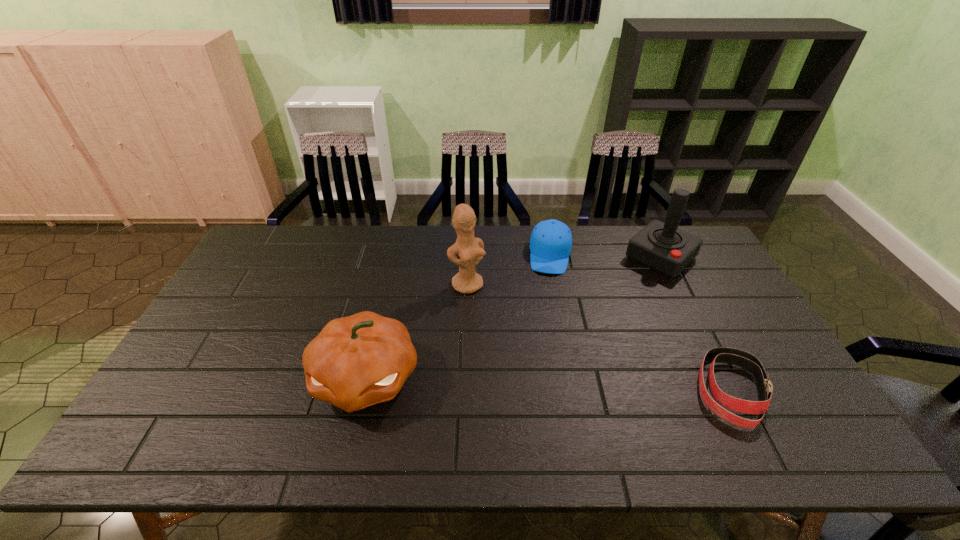
The width and height of the screenshot is (960, 540). I want to click on the leftmost object, so click(x=357, y=361).

At what (x,y) coordinates should I click in order to perform the action: click on pumpkin. Please return your answer as a coordinate pair (x, y). This screenshot has height=540, width=960. Looking at the image, I should click on (357, 361).

Where is `the shortest object`? This screenshot has height=540, width=960. the shortest object is located at coordinates (743, 359).

At what (x,y) coordinates should I click in order to perform the action: click on the second object from left to right. Please return your answer as a coordinate pair (x, y). The width and height of the screenshot is (960, 540). Looking at the image, I should click on (470, 250).

You are a GUI agent. You are given a task and a screenshot of the screen. Output one action in this format:
    pyautogui.click(x=<x>, y=<y>)
    Task: Click on the cap
    This screenshot has height=540, width=960.
    Given the screenshot: What is the action you would take?
    pyautogui.click(x=551, y=240)

This screenshot has width=960, height=540. Identify the location of the third object from right to left. (551, 240).

Find the location of `joystick`. joystick is located at coordinates (662, 247).

Where is `free space located on the back of the dog collar`? This screenshot has height=540, width=960. free space located on the back of the dog collar is located at coordinates (698, 323).

Image resolution: width=960 pixels, height=540 pixels. In order to click on vacant space located on the front-facing side of the fourth object from right to left in this screenshot , I will do `click(514, 343)`.

What are the coordinates of `blank area located on the front-facing side of the fourth object from right to left` in the screenshot? It's located at (493, 318).